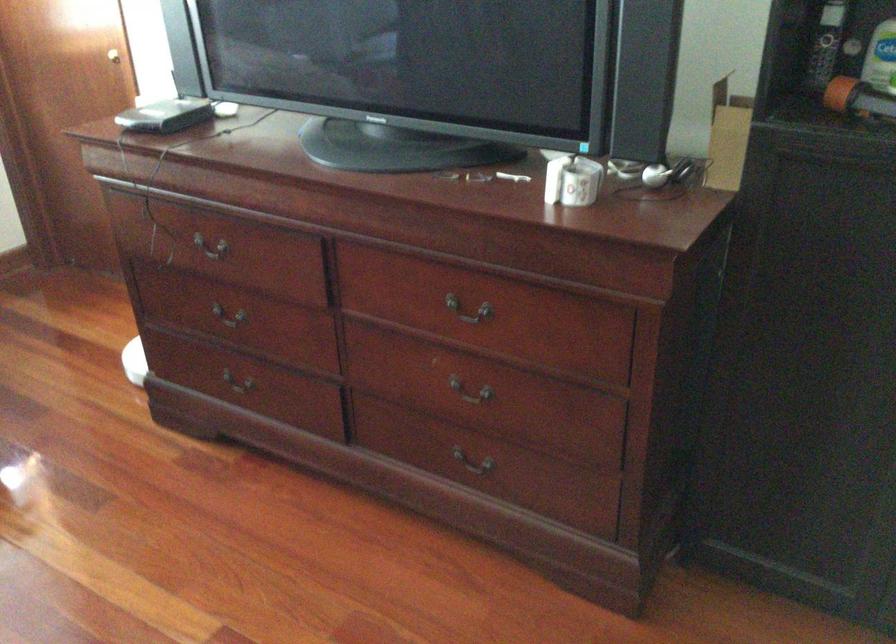
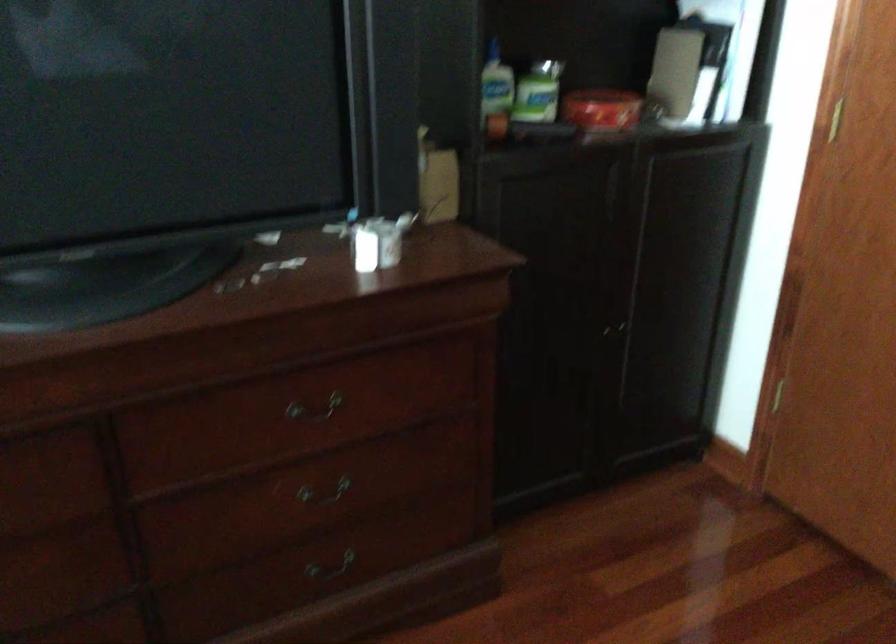
In the second image, find the point that corresponds to point 476,397 in the first image.

(323, 491)